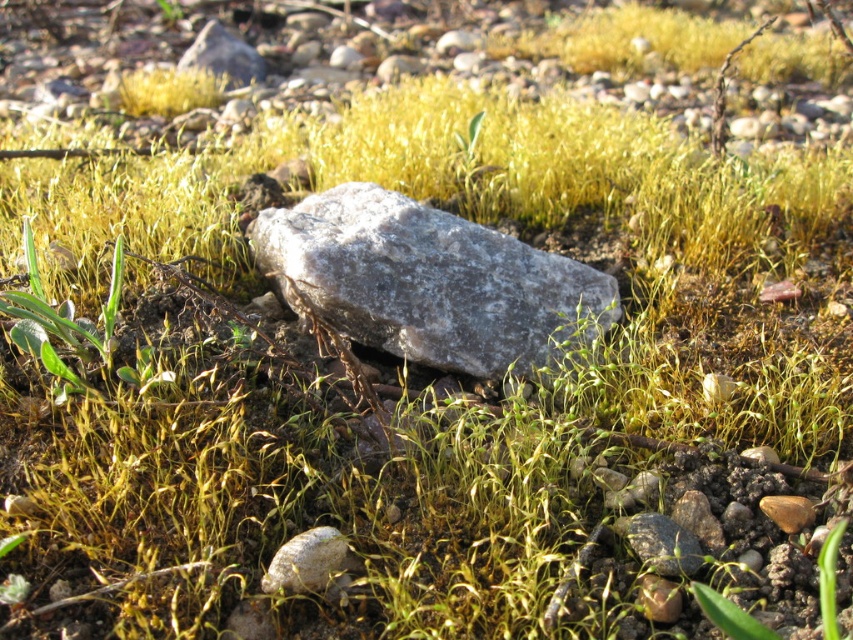
Between gray stone at center and smooth gray rock at lower center, which one has more height?

Standing taller between the two is gray stone at center.

Between point (448, 248) and point (291, 573), which one is positioned in front?

Point (291, 573)

Between point (502, 273) and point (289, 561), which one is positioned behind?

The point (502, 273) is more distant.

Find the location of a particular element. The width and height of the screenshot is (853, 640). gray stone at center is located at coordinates (428, 282).

Is point (403, 310) positioned after point (213, 58)?

That is False.

Between point (331, 276) and point (198, 35), which one is positioned in front?

Point (331, 276) is in front.

Locate an element on the screen. The height and width of the screenshot is (640, 853). gray stone at center is located at coordinates (428, 282).

You are a GUI agent. You are given a task and a screenshot of the screen. Output one action in this format:
    pyautogui.click(x=<x>, y=<y>)
    Task: Click on the gray stone at center
    The width and height of the screenshot is (853, 640).
    Given the screenshot: What is the action you would take?
    pyautogui.click(x=428, y=282)

Is smooth gray rock at lower center to the left of gray rock at upper center from the viewer's perspective?

In fact, smooth gray rock at lower center is to the right of gray rock at upper center.

How much distance is there between smooth gray rock at lower center and gray rock at upper center?

The distance of smooth gray rock at lower center from gray rock at upper center is 12.72 feet.

Is point (274, 572) positioned before point (241, 83)?

Yes, it is in front of point (241, 83).

This screenshot has height=640, width=853. I want to click on smooth gray rock at lower center, so click(308, 561).